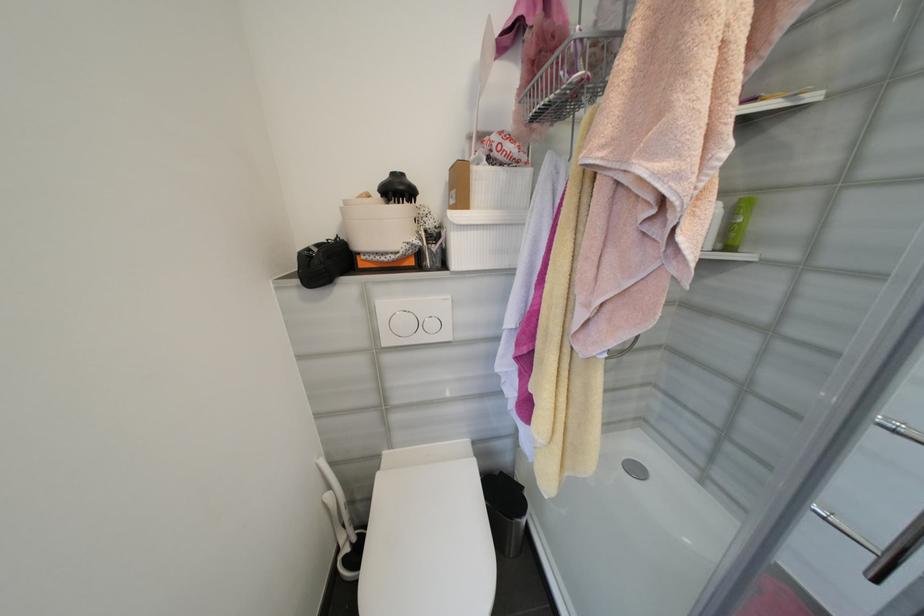
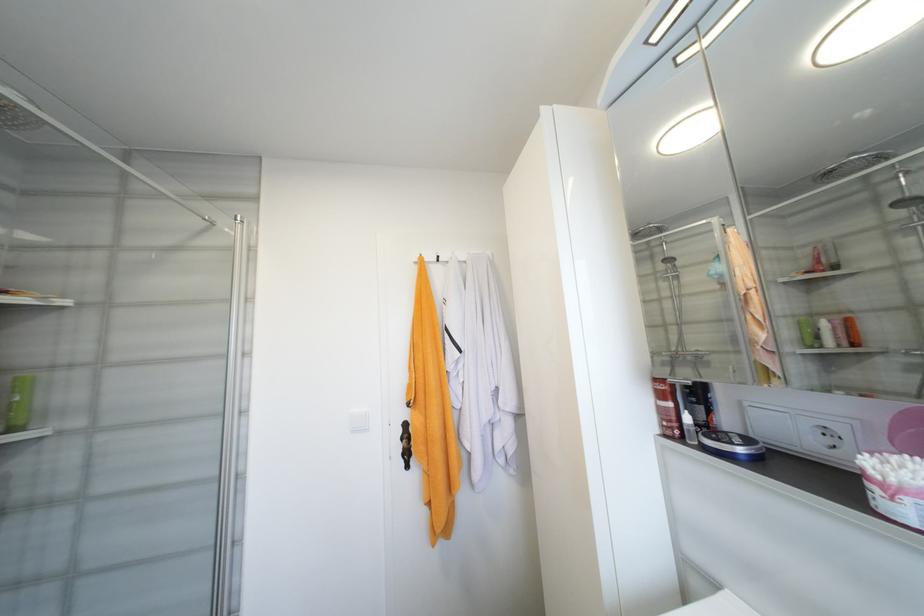
Question: The camera is either moving clockwise (left) or counter-clockwise (right) around the object. The first image is from the beginning of the video and the second image is from the end. Is the camera moving left or right when shooting the video?

Choices:
 (A) Left
 (B) Right

Answer: (A)